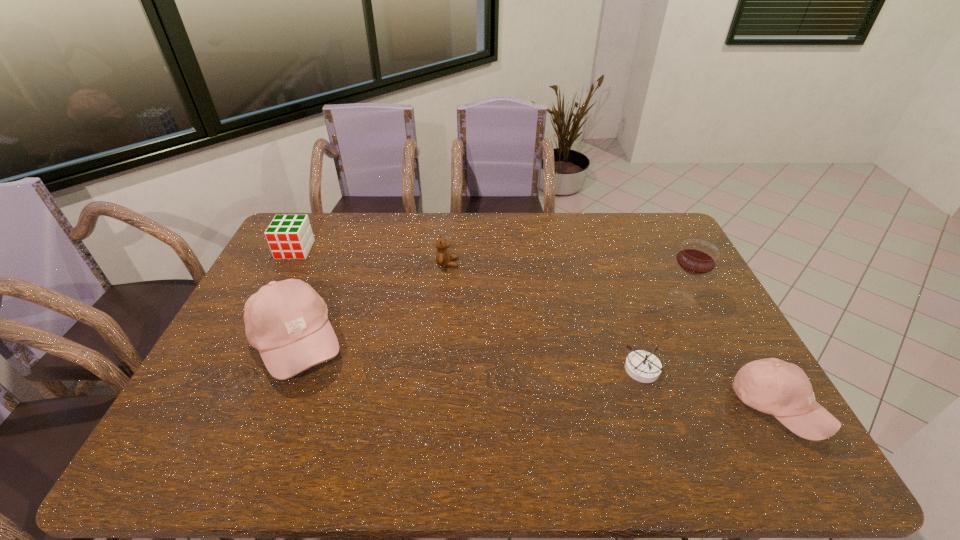
Identify the location of vacant point at the far edge. Image resolution: width=960 pixels, height=540 pixels. (519, 221).

In the image, there is a desktop. Identify the location of free region at the near edge. The width and height of the screenshot is (960, 540). (684, 421).

Locate an element on the screen. The height and width of the screenshot is (540, 960). vacant space at the left edge is located at coordinates 247,380.

This screenshot has width=960, height=540. I want to click on free space at the right edge, so click(x=701, y=320).

You are a GUI agent. You are given a task and a screenshot of the screen. Output one action in this format:
    pyautogui.click(x=<x>, y=<y>)
    Task: Click on the vacant space at the far left corner
    This screenshot has height=540, width=960.
    Given the screenshot: What is the action you would take?
    pyautogui.click(x=329, y=212)

Find the location of a particular element. This screenshot has width=960, height=540. free spot between the cube and the wineglass is located at coordinates (488, 274).

I want to click on vacant region between the shortest object and the wineglass, so click(x=661, y=333).

Locate an element on the screen. This screenshot has width=960, height=540. free area in between the cube and the wineglass is located at coordinates (488, 274).

Identify the location of empty location between the cube and the wineglass. The image size is (960, 540). (488, 274).

Where is `free space between the shortest object and the left baseball cap`? The image size is (960, 540). free space between the shortest object and the left baseball cap is located at coordinates (469, 355).